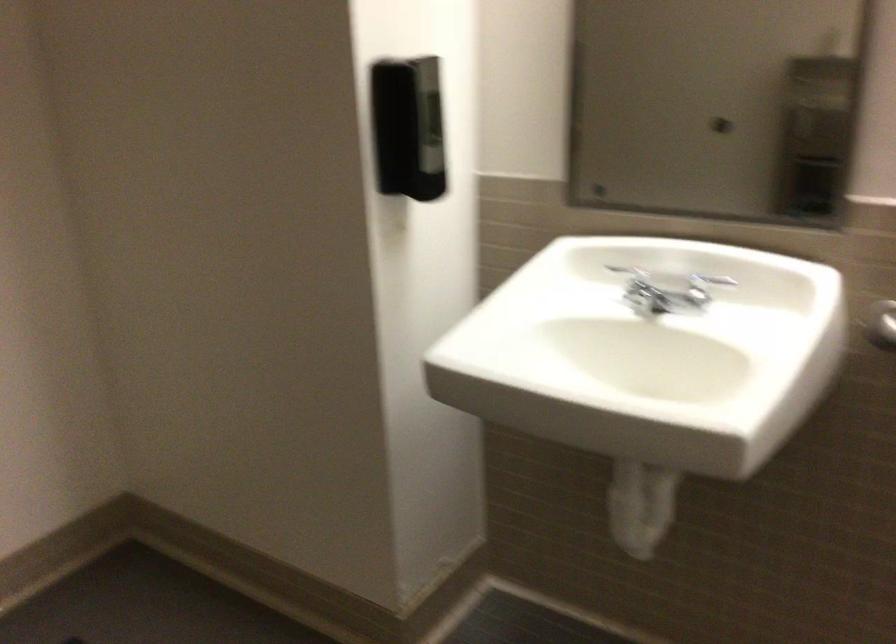
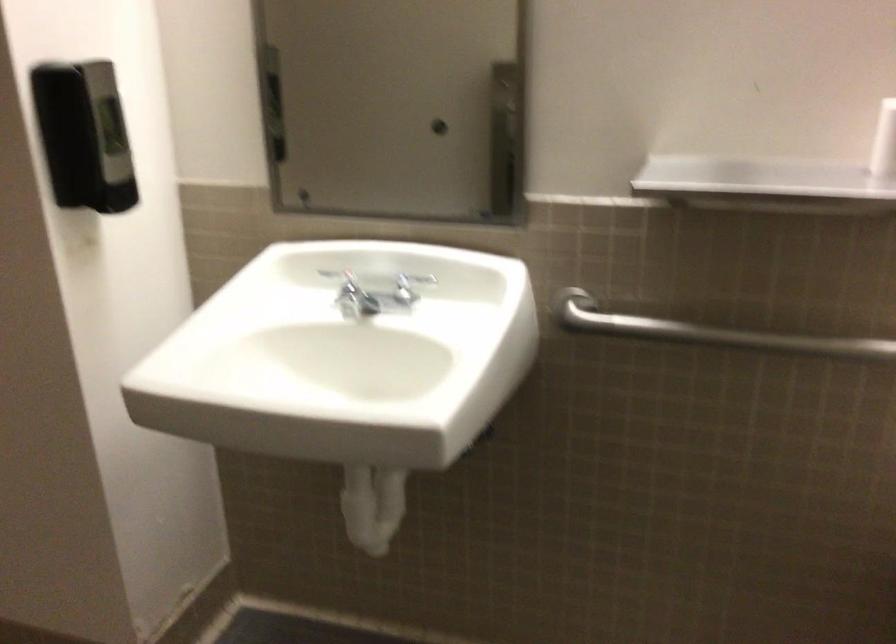
Find the pixel in the second image that matches [633,285] in the first image.

(346, 290)